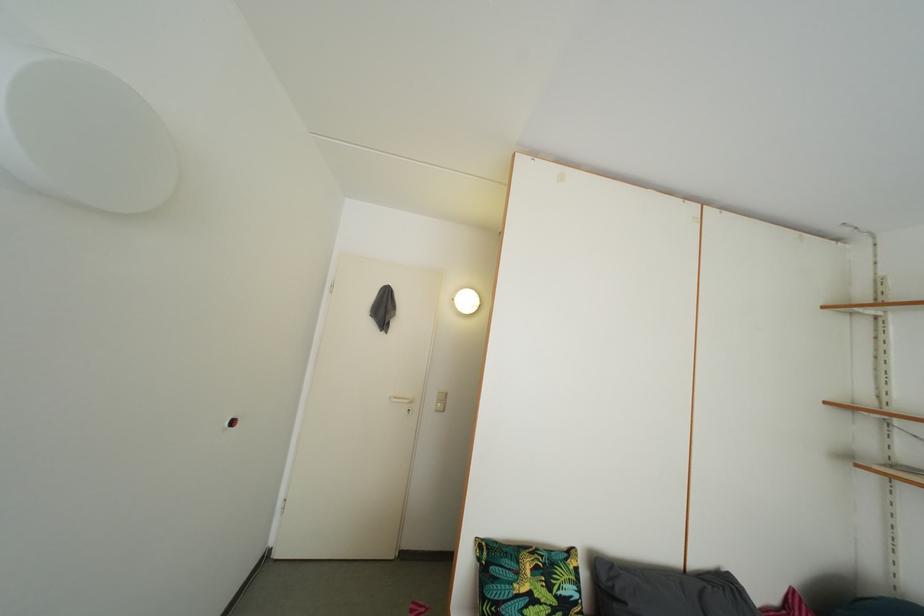
What do you see at coordinates (527, 580) in the screenshot? I see `the patterned green pillow` at bounding box center [527, 580].